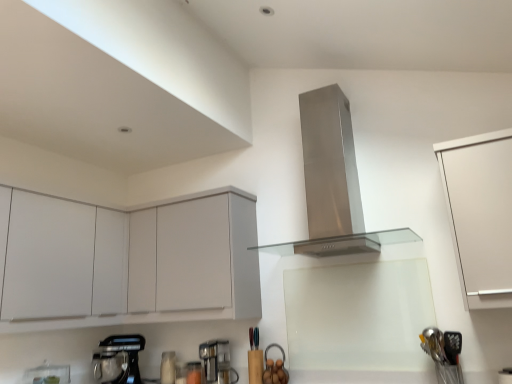
Identify the location of stainless steel range hood at center. (332, 184).

Measure the distance between point (x=447, y=373) and camera.

Point (x=447, y=373) is 7.05 feet from camera.

Locate an element on the screen. The image size is (512, 384). metallic gray coffee machine at lower center is located at coordinates (217, 362).

From a real-world perspective, which is physically below, white matte cabinet at left, which is the 3th cabinetry in right-to-left order, or white matte cabinet at upper left, acting as the 2th cabinetry starting from the right?

white matte cabinet at left, which is the 3th cabinetry in right-to-left order.

Considering the relative sizes of white matte cabinet at left, which is the 3th cabinetry in right-to-left order, and white matte cabinet at upper left, which appears as the second cabinetry when viewed from the left, in the image provided, is white matte cabinet at left, which is the 3th cabinetry in right-to-left order, taller than white matte cabinet at upper left, which appears as the second cabinetry when viewed from the left,?

Correct, white matte cabinet at left, which is the 3th cabinetry in right-to-left order, is much taller as white matte cabinet at upper left, which appears as the second cabinetry when viewed from the left.

Is white matte cabinet at left, which is the 3th cabinetry in right-to-left order, closer to camera compared to white matte cabinet at upper left, which appears as the second cabinetry when viewed from the left?

Yes, it is in front of white matte cabinet at upper left, which appears as the second cabinetry when viewed from the left.

From the image's perspective, which is below, white matte cabinet at left, marked as the first cabinetry in a left-to-right arrangement, or white matte cabinet at upper left, acting as the 2th cabinetry starting from the right?

white matte cabinet at upper left, acting as the 2th cabinetry starting from the right.

Is white matte cabinet at upper left, acting as the 2th cabinetry starting from the right, bigger than white matte cabinet at left, which is the 3th cabinetry in right-to-left order?

Incorrect, white matte cabinet at upper left, acting as the 2th cabinetry starting from the right, is not larger than white matte cabinet at left, which is the 3th cabinetry in right-to-left order.

Is white matte cabinet at upper left, which appears as the second cabinetry when viewed from the left, positioned far away from white matte cabinet at left, which is the 3th cabinetry in right-to-left order?

white matte cabinet at upper left, which appears as the second cabinetry when viewed from the left, is actually quite close to white matte cabinet at left, which is the 3th cabinetry in right-to-left order.

From the image's perspective, who appears lower, white matte cabinet at upper left, which appears as the second cabinetry when viewed from the left, or white matte cabinet at left, which is the 3th cabinetry in right-to-left order?

white matte cabinet at upper left, which appears as the second cabinetry when viewed from the left, appears lower in the image.

From a real-world perspective, which object stands above the other?

From a 3D spatial view, white matte cabinet at upper left, acting as the 2th cabinetry starting from the right, is above.

Is metallic gray coffee machine at lower center thinner than metallic silver mixer at lower left?

Yes.

Which of these two, metallic gray coffee machine at lower center or metallic silver mixer at lower left, stands taller?

Standing taller between the two is metallic silver mixer at lower left.

Is metallic silver mixer at lower left a part of metallic gray coffee machine at lower center?

No, metallic silver mixer at lower left is not a part of metallic gray coffee machine at lower center.

Considering the sizes of white matte cabinet at upper left, which appears as the second cabinetry when viewed from the left, and stainless steel range hood at center in the image, is white matte cabinet at upper left, which appears as the second cabinetry when viewed from the left, bigger or smaller than stainless steel range hood at center?

white matte cabinet at upper left, which appears as the second cabinetry when viewed from the left, is smaller than stainless steel range hood at center.

Is the surface of white matte cabinet at upper left, which appears as the second cabinetry when viewed from the left, in direct contact with stainless steel range hood at center?

No, white matte cabinet at upper left, which appears as the second cabinetry when viewed from the left, is not in contact with stainless steel range hood at center.

How much distance is there between white matte cabinet at upper left, acting as the 2th cabinetry starting from the right, and stainless steel range hood at center?

white matte cabinet at upper left, acting as the 2th cabinetry starting from the right, is 64.33 centimeters from stainless steel range hood at center.

From the image's perspective, is white matte cabinet at upper left, acting as the 2th cabinetry starting from the right, below stainless steel range hood at center?

Correct, white matte cabinet at upper left, acting as the 2th cabinetry starting from the right, appears lower than stainless steel range hood at center in the image.

From the image's perspective, is stainless steel range hood at center over metallic silver mixer at lower left?

Yes, from the image's perspective, stainless steel range hood at center is above metallic silver mixer at lower left.

Can you tell me how much stainless steel range hood at center and metallic silver mixer at lower left differ in facing direction?

stainless steel range hood at center and metallic silver mixer at lower left are facing 45.1 degrees away from each other.

Can we say stainless steel range hood at center lies outside metallic silver mixer at lower left?

Yes.

Is stainless steel range hood at center turned away from metallic silver mixer at lower left?

stainless steel range hood at center does not have its back to metallic silver mixer at lower left.

Considering the sizes of metallic gray coffee machine at lower center and satin silver utensils at lower right in the image, is metallic gray coffee machine at lower center bigger or smaller than satin silver utensils at lower right?

Clearly, metallic gray coffee machine at lower center is smaller in size than satin silver utensils at lower right.

You are a GUI agent. You are given a task and a screenshot of the screen. Output one action in this format:
    pyautogui.click(x=<x>, y=<y>)
    Task: Click on the silverware above the metallic gray coffee machine at lower center (from the image's perspective)
    This screenshot has width=512, height=384.
    Given the screenshot: What is the action you would take?
    pyautogui.click(x=444, y=353)

Is metallic gray coffee machine at lower center inside the boundaries of satin silver utensils at lower right, or outside?

metallic gray coffee machine at lower center is spatially situated outside satin silver utensils at lower right.

From their relative heights in the image, would you say metallic gray coffee machine at lower center is taller or shorter than satin silver utensils at lower right?

In the image, metallic gray coffee machine at lower center appears to be shorter than satin silver utensils at lower right.

What's the angular difference between stainless steel range hood at center and metallic gray coffee machine at lower center's facing directions?

The facing directions of stainless steel range hood at center and metallic gray coffee machine at lower center are 1.19 degrees apart.

This screenshot has height=384, width=512. What are the coordinates of `coffee machine located below the stainless steel range hood at center (from the image's perspective)` in the screenshot? It's located at 217,362.

Could you measure the distance between stainless steel range hood at center and metallic gray coffee machine at lower center?

stainless steel range hood at center and metallic gray coffee machine at lower center are 4.13 feet apart.

Is stainless steel range hood at center oriented towards metallic gray coffee machine at lower center?

No, stainless steel range hood at center is not oriented towards metallic gray coffee machine at lower center.

The width and height of the screenshot is (512, 384). In the image, there is a white matte cabinet at left, marked as the first cabinetry in a left-to-right arrangement. In order to click on cabinetry below it (from the image's perspective) in this screenshot , I will do `click(216, 247)`.

From the white matte cabinet at left, which is the 3th cabinetry in right-to-left order, count 1st cabinetry to the right and point to it. Please provide its 2D coordinates.

[(216, 247)]

Estimate the real-world distances between objects in this image. Which object is further from metallic silver mixer at lower left, white matte cabinet at upper left, acting as the 2th cabinetry starting from the right, or metallic gray coffee machine at lower center?

white matte cabinet at upper left, acting as the 2th cabinetry starting from the right, is further to metallic silver mixer at lower left.

Looking at the image, which one is located further to white matte cabinet at upper left, acting as the 2th cabinetry starting from the right, stainless steel range hood at center or white matte cabinet at left, marked as the first cabinetry in a left-to-right arrangement?

white matte cabinet at left, marked as the first cabinetry in a left-to-right arrangement, is positioned further to the anchor white matte cabinet at upper left, acting as the 2th cabinetry starting from the right.

When comparing their distances from metallic gray coffee machine at lower center, does metallic silver mixer at lower left or satin silver utensils at lower right seem closer?

The object closer to metallic gray coffee machine at lower center is metallic silver mixer at lower left.

From the image, which object appears to be farther from satin silver utensils at lower right, metallic gray coffee machine at lower center or stainless steel range hood at center?

Among the two, metallic gray coffee machine at lower center is located further to satin silver utensils at lower right.

Based on the photo, from the image, which object appears to be farther from metallic silver mixer at lower left, white matte cabinet at right, the 1th cabinetry from the right, or white matte cabinet at upper left, which appears as the second cabinetry when viewed from the left?

Among the two, white matte cabinet at right, the 1th cabinetry from the right, is located further to metallic silver mixer at lower left.

When comparing their distances from white matte cabinet at upper left, which appears as the second cabinetry when viewed from the left, does white matte cabinet at left, marked as the first cabinetry in a left-to-right arrangement, or metallic gray coffee machine at lower center seem closer?

metallic gray coffee machine at lower center is positioned closer to the anchor white matte cabinet at upper left, which appears as the second cabinetry when viewed from the left.

Looking at the image, which one is located further to white matte cabinet at right, the 1th cabinetry from the right, white matte cabinet at upper left, which appears as the second cabinetry when viewed from the left, or white matte cabinet at left, marked as the first cabinetry in a left-to-right arrangement?

white matte cabinet at left, marked as the first cabinetry in a left-to-right arrangement, lies further to white matte cabinet at right, the 1th cabinetry from the right, than the other object.

Considering their positions, is metallic silver mixer at lower left positioned closer to white matte cabinet at upper left, which appears as the second cabinetry when viewed from the left, than stainless steel range hood at center?

stainless steel range hood at center lies closer to white matte cabinet at upper left, which appears as the second cabinetry when viewed from the left, than the other object.

At what (x,y) coordinates should I click in order to perform the action: click on home appliance located between metallic gray coffee machine at lower center and white matte cabinet at right, which is the 3th cabinetry from left to right, in the left-right direction. Please return your answer as a coordinate pair (x, y). This screenshot has width=512, height=384. Looking at the image, I should click on (332, 184).

Locate an element on the screen. This screenshot has width=512, height=384. kitchen appliance situated between white matte cabinet at left, marked as the first cabinetry in a left-to-right arrangement, and metallic gray coffee machine at lower center from left to right is located at coordinates (118, 359).

The image size is (512, 384). What are the coordinates of `kitchen appliance situated between white matte cabinet at left, which is the 3th cabinetry in right-to-left order, and stainless steel range hood at center from left to right` in the screenshot? It's located at (118, 359).

Where is `home appliance located between white matte cabinet at left, which is the 3th cabinetry in right-to-left order, and satin silver utensils at lower right in the left-right direction`? home appliance located between white matte cabinet at left, which is the 3th cabinetry in right-to-left order, and satin silver utensils at lower right in the left-right direction is located at coordinates (332, 184).